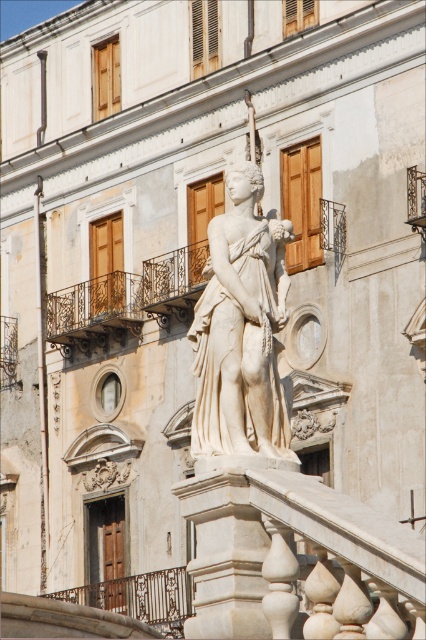
Is point (287, 230) farther from viewer compared to point (120, 602)?

No, it is not.

Between point (287, 237) and point (187, 584), which one is positioned behind?

The point (187, 584) is more distant.

Where is `white marble statue at center`? The image size is (426, 640). white marble statue at center is located at coordinates (241, 330).

Which is behind, point (212, 620) or point (154, 573)?

The point (154, 573) is more distant.

Which of these two, white marble pillar at center or dark brown wrought iron balustrade at center, stands shorter?

dark brown wrought iron balustrade at center is shorter.

Does point (247, 600) lie behind point (127, 609)?

No, it is in front of (127, 609).

At what (x,y) coordinates should I click in order to perform the action: click on white marble pillar at center. Please return your answer as a coordinate pair (x, y). This screenshot has width=426, height=640. Looking at the image, I should click on (224, 556).

Is white marble statue at center further to camera compared to white marble pillar at center?

That is True.

I want to click on white marble statue at center, so click(241, 330).